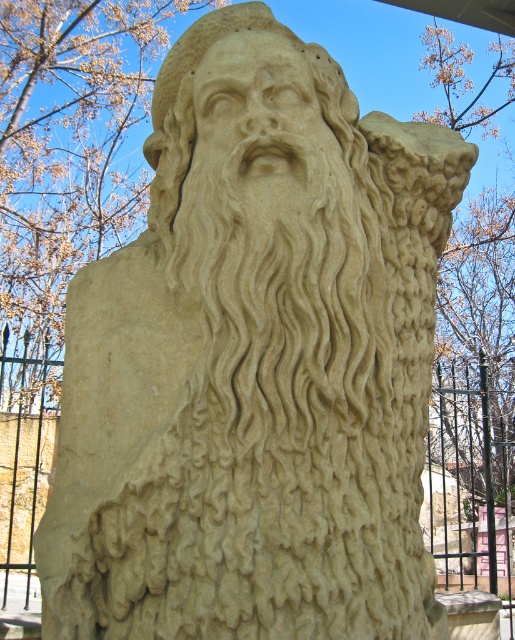
Identify the location of black metal fence at upper center. This screenshot has width=515, height=640. (468, 500).

Is point (500, 426) behind point (282, 33)?

Yes, it is.

The image size is (515, 640). I want to click on black metal fence at upper center, so click(468, 500).